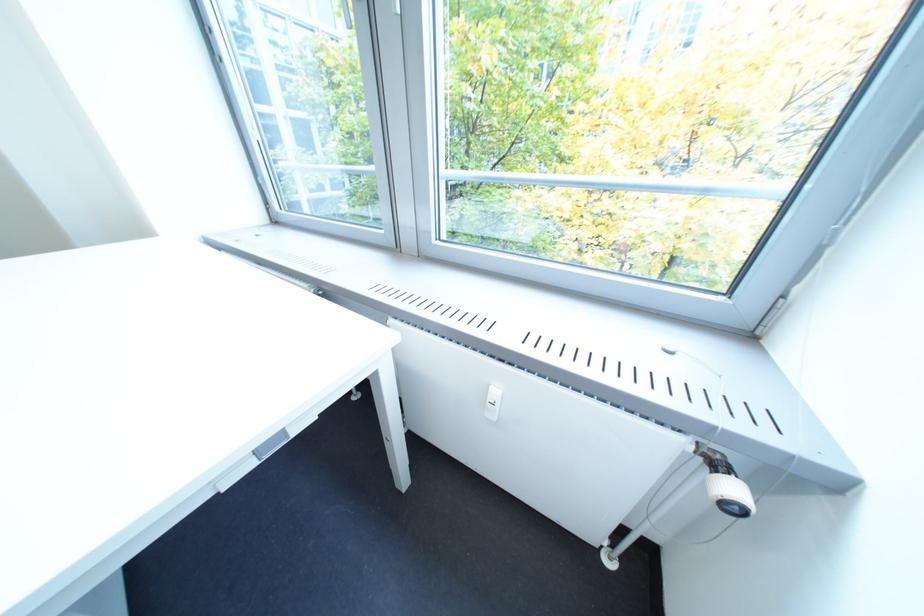
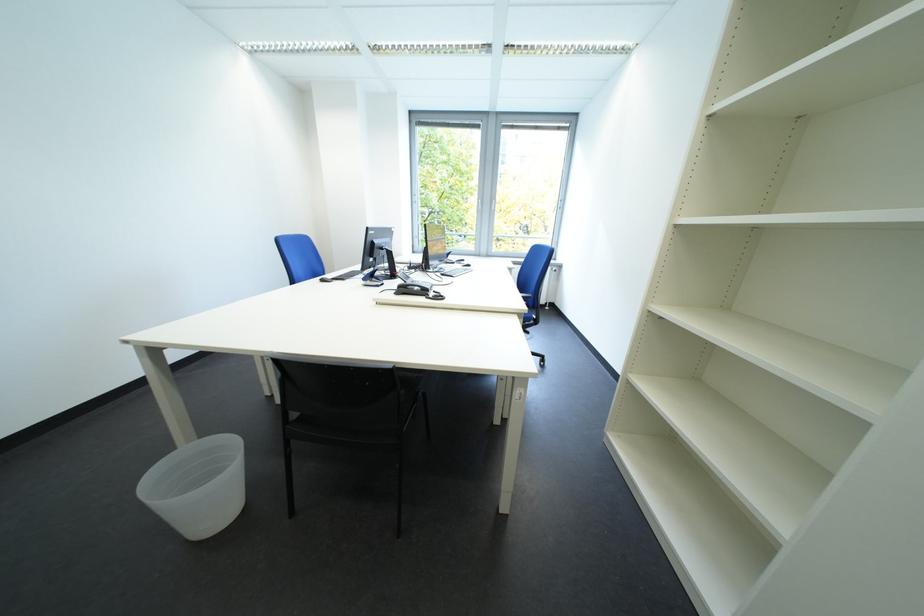
The images are taken continuously from a first-person perspective. In which direction are you moving?

The movement direction of the cameraman is left, backward.